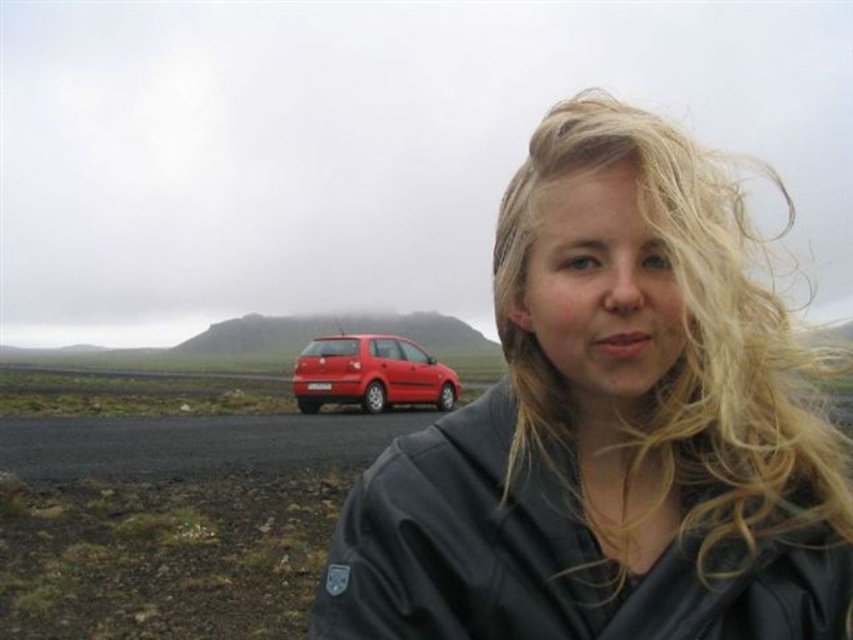
You are standing in the remote landscape and want to walk towards the two points marked in the image. Which point, point (735, 368) or point (442, 369), will you reach first?

Point (735, 368) is closer to the viewer than point (442, 369), so you will reach point (735, 368) first.

Based on the photo, you are a photographer trying to capture the scene with a camera. You notice the blonde silky hair at center and the shiny red hatchback at center. Which object appears bigger in the photo?

The blonde silky hair at center appears bigger in the photo because it is larger in size than the shiny red hatchback at center.

You are a photographer trying to capture a wide shot of the blonde silky hair at center and the shiny red hatchback at center. If your camera can only focus on objects wider than 1 meter, will both objects be in focus?

The blonde silky hair at center might be wider than shiny red hatchback at center, so the photographer should check the actual width of both objects to ensure they meet the camera focus requirement of being wider than 1 meter.